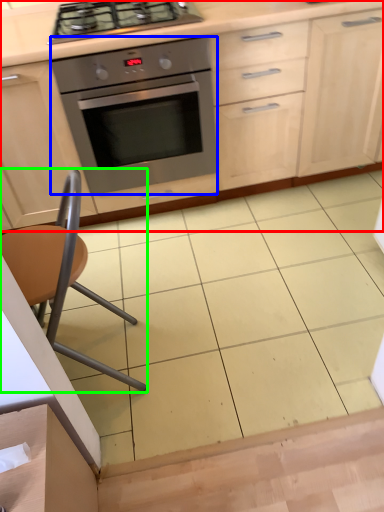
Question: Based on their relative distances, which object is farther from cabinetry (highlighted by a red box)? Choose from oven (highlighted by a blue box) and chair (highlighted by a green box).

Choices:
 (A) oven
 (B) chair

Answer: (B)